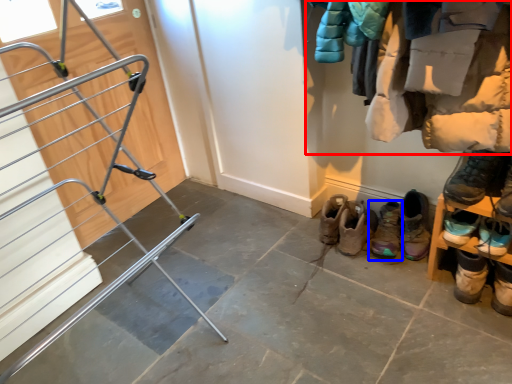
Question: Which of the following is the closest to the observer, closet (highlighted by a red box) or footwear (highlighted by a blue box)?

Choices:
 (A) closet
 (B) footwear

Answer: (A)